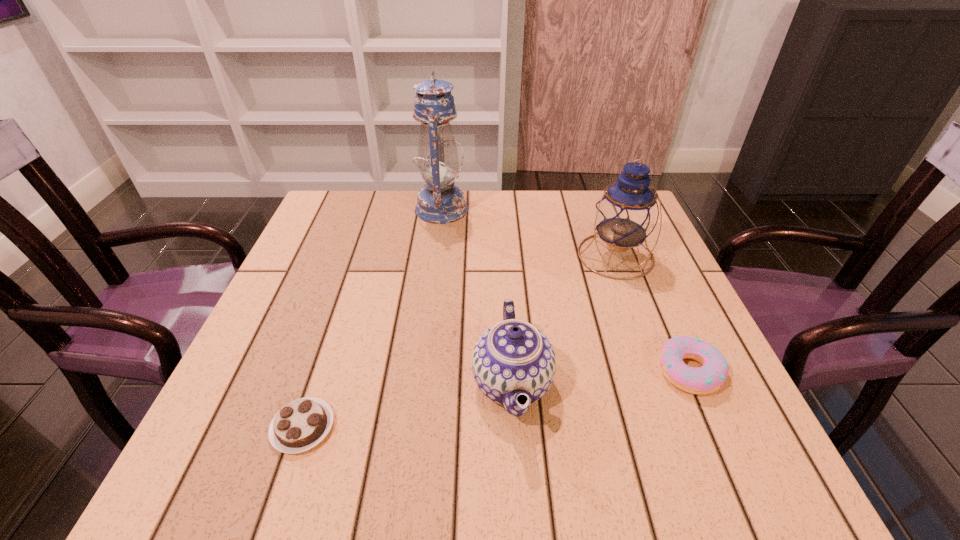
In the image, there is a desktop. Identify the location of vacant area at the near right corner. Image resolution: width=960 pixels, height=540 pixels. (739, 450).

The width and height of the screenshot is (960, 540). Find the location of `free spot between the farther lantern and the doughnut`. free spot between the farther lantern and the doughnut is located at coordinates (565, 290).

Image resolution: width=960 pixels, height=540 pixels. I want to click on unoccupied area between the tallest object and the doughnut, so click(x=565, y=290).

The height and width of the screenshot is (540, 960). Identify the location of vacant space that is in between the shortest object and the second farthest object. (459, 341).

Locate an element on the screen. The image size is (960, 540). empty location between the left lantern and the third tallest object is located at coordinates (477, 296).

This screenshot has width=960, height=540. What are the coordinates of `vacant space in between the tallest object and the chocolate cake` in the screenshot? It's located at (372, 318).

Locate an element on the screen. Image resolution: width=960 pixels, height=540 pixels. free area in between the nearer lantern and the third shortest object is located at coordinates (564, 320).

Locate an element on the screen. free space between the fourth nearest object and the taller lantern is located at coordinates (528, 232).

This screenshot has height=540, width=960. Find the location of `vacant area that lies between the doughnut and the nearer lantern`. vacant area that lies between the doughnut and the nearer lantern is located at coordinates (653, 313).

Where is `vacant space that is in between the doughnut and the chinaware`? vacant space that is in between the doughnut and the chinaware is located at coordinates pos(601,377).